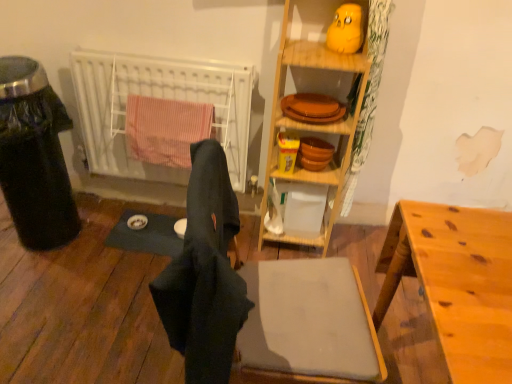
Identify the location of vacant space in front of transparent plastic trash can at left. The image size is (512, 384). (39, 283).